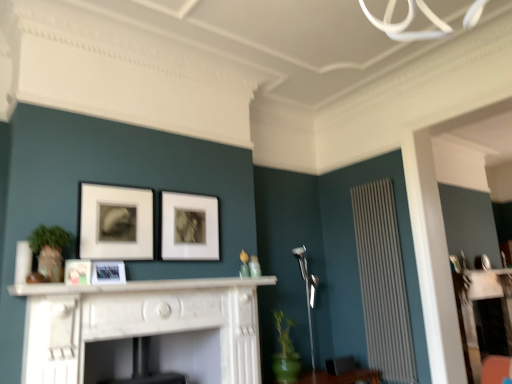
Question: Is white glossy picture frame at center, marked as the fourth picture frame in a right-to-left arrangement, shorter than white textured radiator at right?

Choices:
 (A) yes
 (B) no

Answer: (A)

Question: From the image's perspective, is white glossy picture frame at center, the first picture frame viewed from the left, located above white textured radiator at right?

Choices:
 (A) yes
 (B) no

Answer: (A)

Question: Considering the relative sizes of white glossy picture frame at center, the first picture frame viewed from the left, and white textured radiator at right in the image provided, is white glossy picture frame at center, the first picture frame viewed from the left, taller than white textured radiator at right?

Choices:
 (A) no
 (B) yes

Answer: (A)

Question: Does white glossy picture frame at center, the first picture frame viewed from the left, lie behind white textured radiator at right?

Choices:
 (A) yes
 (B) no

Answer: (B)

Question: From the image's perspective, is white glossy picture frame at center, marked as the fourth picture frame in a right-to-left arrangement, below white textured radiator at right?

Choices:
 (A) no
 (B) yes

Answer: (A)

Question: Considering their positions, is white marble fireplace at center located in front of or behind matte white picture frame at upper left, which is counted as the third picture frame, starting from the left?

Choices:
 (A) behind
 (B) front

Answer: (B)

Question: From the image's perspective, is white marble fireplace at center located above or below matte white picture frame at upper left, which is counted as the third picture frame, starting from the left?

Choices:
 (A) below
 (B) above

Answer: (A)

Question: Is white marble fireplace at center taller or shorter than matte white picture frame at upper left, which is counted as the third picture frame, starting from the left?

Choices:
 (A) tall
 (B) short

Answer: (A)

Question: Looking at their shapes, would you say white marble fireplace at center is wider or thinner than matte white picture frame at upper left, which is counted as the third picture frame, starting from the left?

Choices:
 (A) wide
 (B) thin

Answer: (A)

Question: Is matte white picture frame at center, the third picture frame in the right-to-left sequence, bigger or smaller than white textured radiator at right?

Choices:
 (A) small
 (B) big

Answer: (A)

Question: In the image, is matte white picture frame at center, the third picture frame in the right-to-left sequence, positioned in front of or behind white textured radiator at right?

Choices:
 (A) front
 (B) behind

Answer: (A)

Question: From a real-world perspective, is matte white picture frame at center, placed as the second picture frame when sorted from left to right, positioned above or below white textured radiator at right?

Choices:
 (A) above
 (B) below

Answer: (A)

Question: Considering the positions of matte white picture frame at center, the third picture frame in the right-to-left sequence, and white textured radiator at right in the image, is matte white picture frame at center, the third picture frame in the right-to-left sequence, taller or shorter than white textured radiator at right?

Choices:
 (A) short
 (B) tall

Answer: (A)

Question: From the image's perspective, relative to matte white picture frame at center, placed as the second picture frame when sorted from left to right, is white glossy picture frame at center, the first picture frame viewed from the left, above or below?

Choices:
 (A) below
 (B) above

Answer: (B)

Question: Looking at the image, does white glossy picture frame at center, marked as the fourth picture frame in a right-to-left arrangement, seem bigger or smaller compared to matte white picture frame at center, placed as the second picture frame when sorted from left to right?

Choices:
 (A) small
 (B) big

Answer: (A)